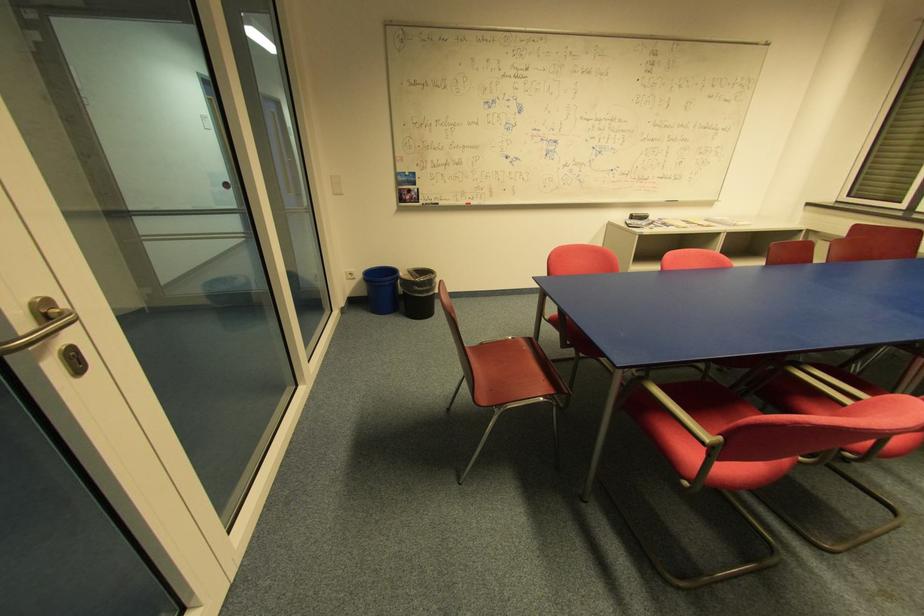
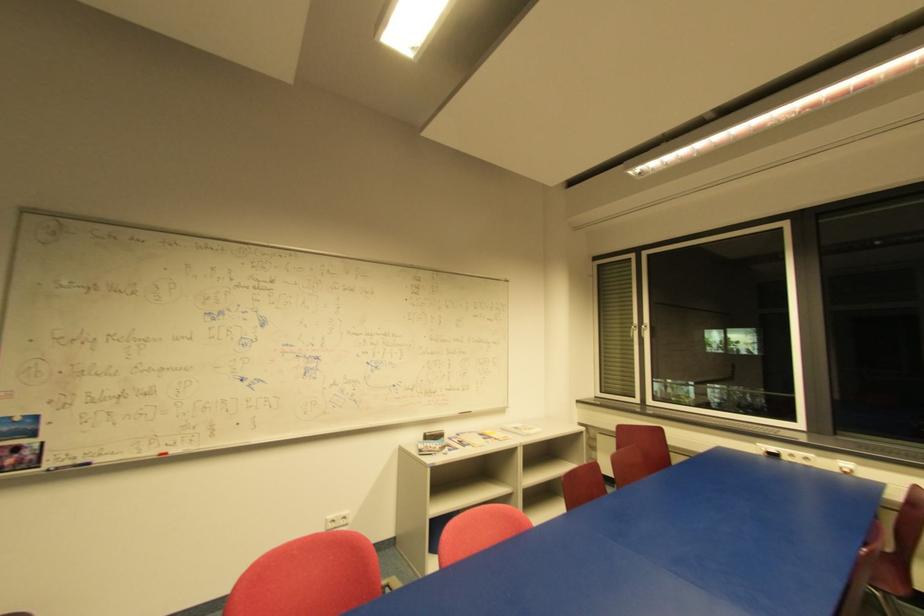
First-person continuous shooting, in which direction is the camera rotating?

The camera rotated toward right-up.